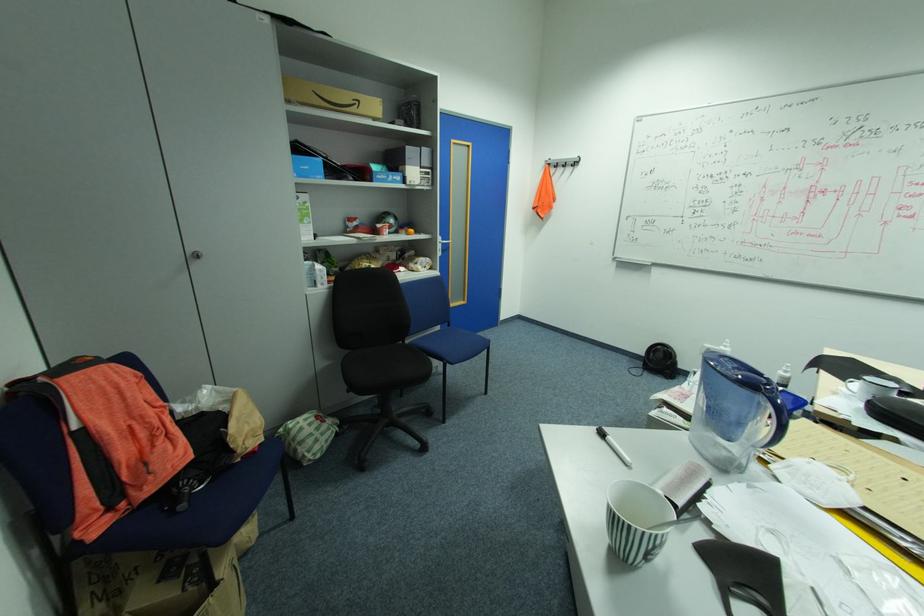
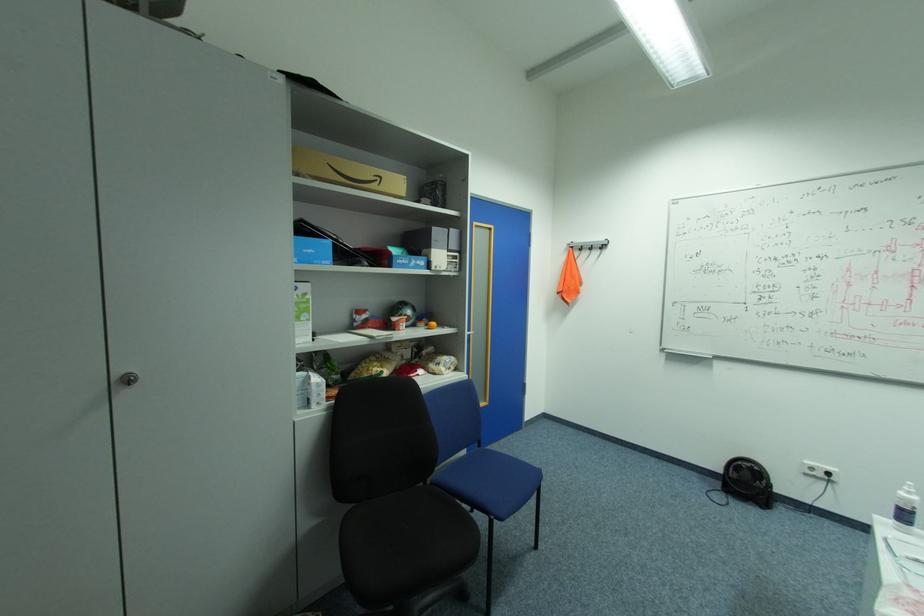
Find the pixel in the second image that matches pixel 563 166 in the first image.

(588, 249)